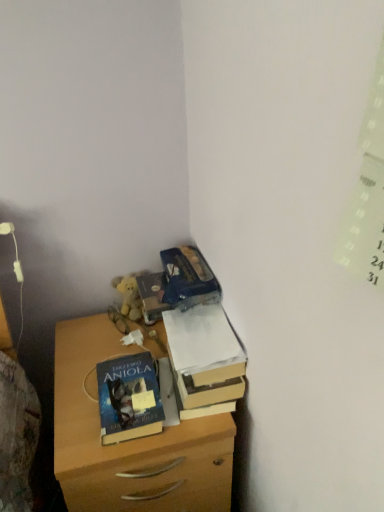
Locate an element on the screen. The width and height of the screenshot is (384, 512). free point above wooden chest of drawers at lower left (from a real-world perspective) is located at coordinates (110, 356).